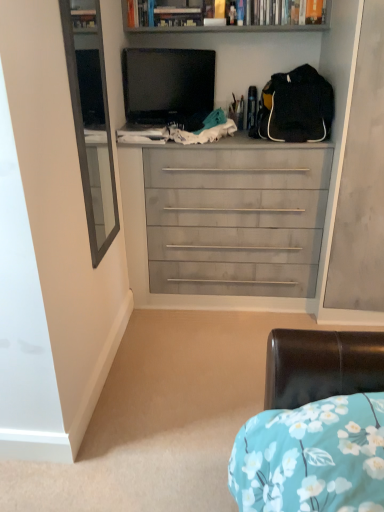
Question: From the image's perspective, is black matte backpack at upper right on top of matte black tv at upper center?

Choices:
 (A) yes
 (B) no

Answer: (B)

Question: Can you confirm if black matte backpack at upper right is shorter than matte black tv at upper center?

Choices:
 (A) yes
 (B) no

Answer: (A)

Question: From a real-world perspective, is black matte backpack at upper right under matte black tv at upper center?

Choices:
 (A) yes
 (B) no

Answer: (A)

Question: Does black matte backpack at upper right lie behind matte black tv at upper center?

Choices:
 (A) yes
 (B) no

Answer: (B)

Question: Considering the relative sizes of black matte backpack at upper right and matte black tv at upper center in the image provided, is black matte backpack at upper right thinner than matte black tv at upper center?

Choices:
 (A) yes
 (B) no

Answer: (B)

Question: Is black matte backpack at upper right taller than matte black tv at upper center?

Choices:
 (A) yes
 (B) no

Answer: (B)

Question: Can black matte backpack at upper right be found inside hardcover book at upper center?

Choices:
 (A) yes
 (B) no

Answer: (B)

Question: Is hardcover book at upper center to the right of black matte backpack at upper right from the viewer's perspective?

Choices:
 (A) yes
 (B) no

Answer: (B)

Question: Is hardcover book at upper center positioned before black matte backpack at upper right?

Choices:
 (A) yes
 (B) no

Answer: (B)

Question: Is hardcover book at upper center further to camera compared to black matte backpack at upper right?

Choices:
 (A) yes
 (B) no

Answer: (A)

Question: Considering the relative sizes of hardcover book at upper center and black matte backpack at upper right in the image provided, is hardcover book at upper center bigger than black matte backpack at upper right?

Choices:
 (A) yes
 (B) no

Answer: (B)

Question: From the image's perspective, would you say hardcover book at upper center is positioned over black matte backpack at upper right?

Choices:
 (A) no
 (B) yes

Answer: (B)

Question: Is wooden bookshelf at upper center at the left side of hardcover book at upper center?

Choices:
 (A) yes
 (B) no

Answer: (B)